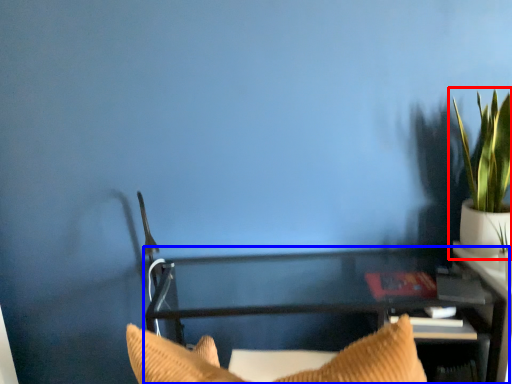
Question: Which of the following is the farthest to the observer, houseplant (highlighted by a red box) or furniture (highlighted by a blue box)?

Choices:
 (A) houseplant
 (B) furniture

Answer: (A)